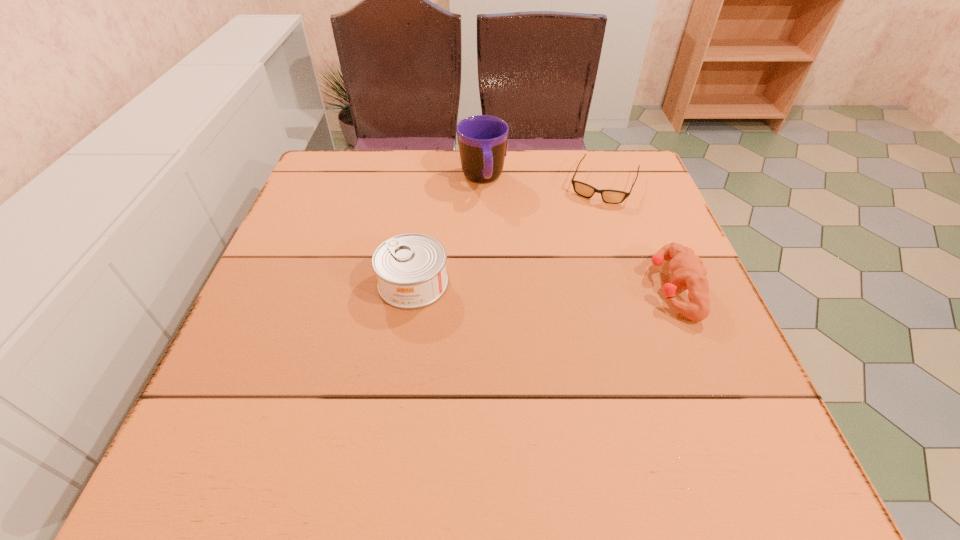
Locate an element on the screen. The height and width of the screenshot is (540, 960). the leftmost object is located at coordinates (410, 268).

What are the coordinates of `puncher` in the screenshot? It's located at tap(688, 272).

Identify the location of the second object from left to right. (482, 139).

Identify the location of the tallest object. click(x=482, y=139).

Where is `the shortest object`? This screenshot has height=540, width=960. the shortest object is located at coordinates (585, 190).

Locate an element on the screen. This screenshot has width=960, height=540. vacant space located on the back of the can is located at coordinates (423, 213).

Where is `vacant space situated 0.380m with the gloves of the puncher facing forward`? This screenshot has width=960, height=540. vacant space situated 0.380m with the gloves of the puncher facing forward is located at coordinates (463, 288).

Where is `vacant region located 0.090m with the gloves of the puncher facing forward`? The image size is (960, 540). vacant region located 0.090m with the gloves of the puncher facing forward is located at coordinates (607, 288).

I want to click on free space located 0.100m with the gloves of the puncher facing forward, so [602, 288].

This screenshot has width=960, height=540. I want to click on vacant space situated with the handle on the side of the mug, so click(x=499, y=258).